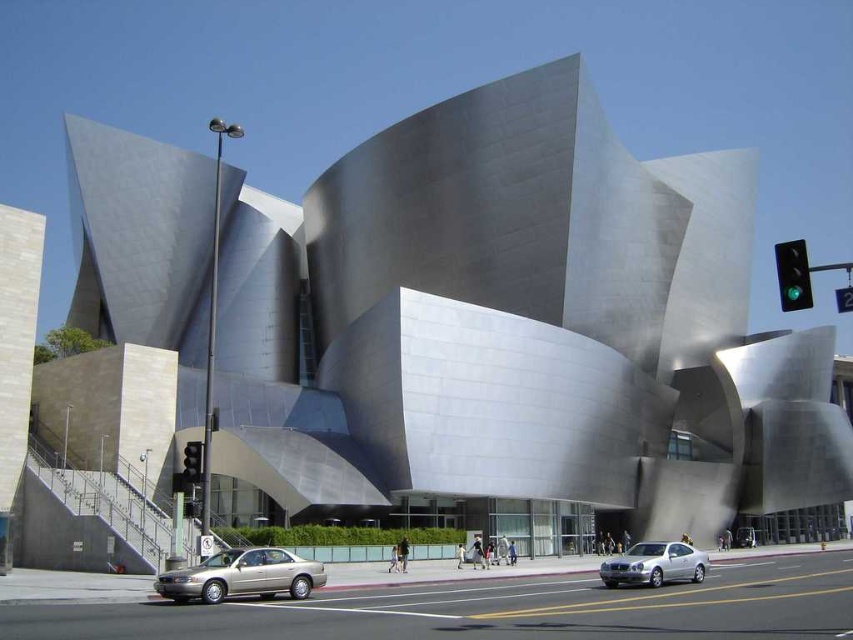
Does gold metallic sedan at lower center have a larger size compared to green glass traffic light at upper right?

Actually, gold metallic sedan at lower center might be smaller than green glass traffic light at upper right.

Does gold metallic sedan at lower center appear on the right side of green glass traffic light at upper right?

In fact, gold metallic sedan at lower center is to the left of green glass traffic light at upper right.

Between point (161, 577) and point (799, 262), which one is positioned behind?

The point (161, 577) is behind.

The width and height of the screenshot is (853, 640). Find the location of `gold metallic sedan at lower center`. gold metallic sedan at lower center is located at coordinates (242, 576).

Based on the photo, does gold metallic sedan at lower center have a smaller size compared to red glass traffic light at lower left?

Yes.

Who is more distant from viewer, [202,572] or [200,472]?

The point [200,472] is more distant.

The height and width of the screenshot is (640, 853). What are the coordinates of `gold metallic sedan at lower center` in the screenshot? It's located at (242, 576).

Can you confirm if green glass traffic light at upper right is smaller than red glass traffic light at lower left?

No, green glass traffic light at upper right is not smaller than red glass traffic light at lower left.

In order to click on green glass traffic light at upper right in this screenshot , I will do `click(793, 275)`.

Locate an element on the screen. green glass traffic light at upper right is located at coordinates (793, 275).

Find the location of `green glass traffic light at upper right`. green glass traffic light at upper right is located at coordinates (793, 275).